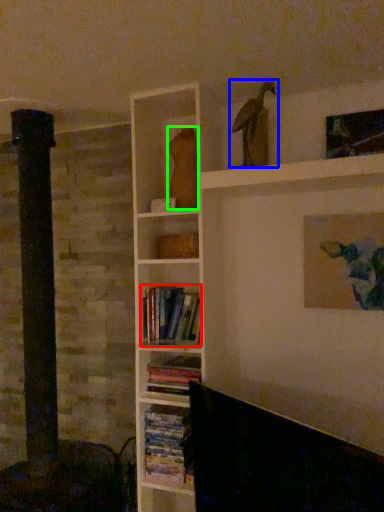
Question: Which is farther away from book (highlighted by a red box)? bird (highlighted by a blue box) or animal (highlighted by a green box)?

Choices:
 (A) bird
 (B) animal

Answer: (A)